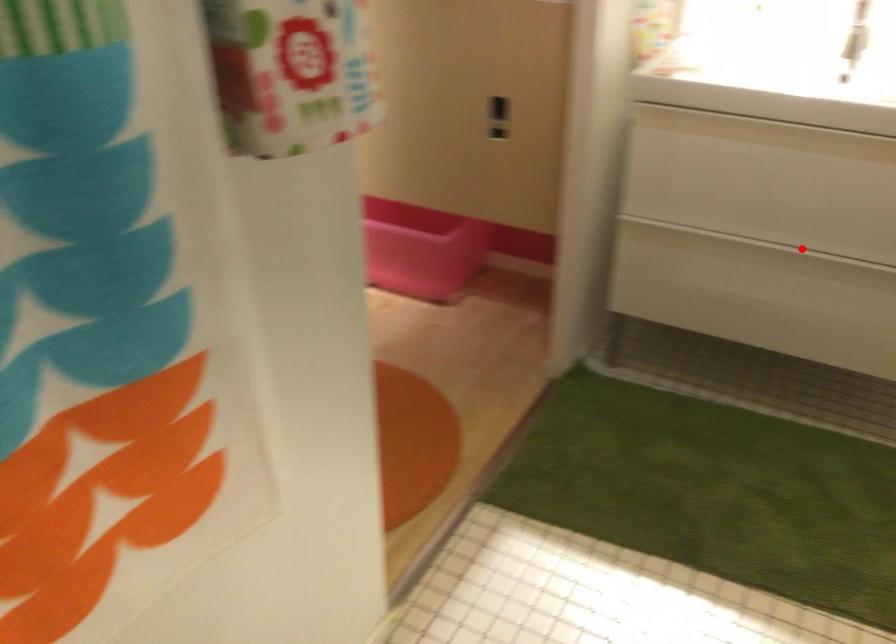
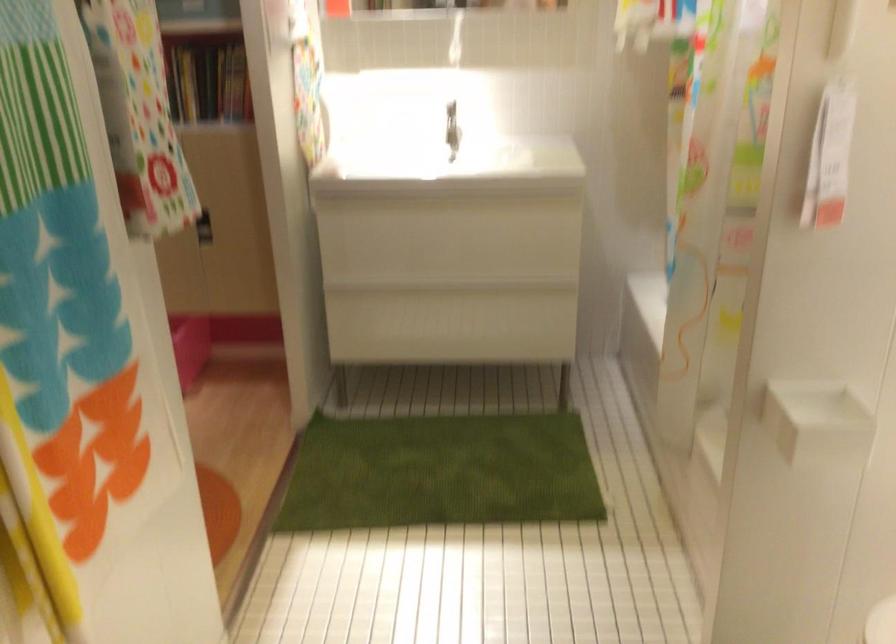
The point at the highlighted location is marked in the first image. Where is the corresponding point in the second image?

(453, 288)